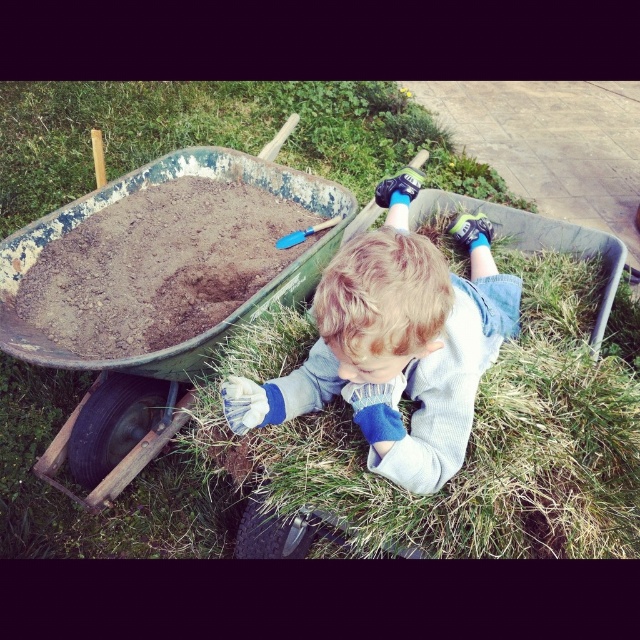
Is brown gravel at center thinner than blue denim jeans at lower center?

In fact, brown gravel at center might be wider than blue denim jeans at lower center.

The height and width of the screenshot is (640, 640). Describe the element at coordinates (157, 266) in the screenshot. I see `brown gravel at center` at that location.

You are a GUI agent. You are given a task and a screenshot of the screen. Output one action in this format:
    pyautogui.click(x=<x>, y=<y>)
    Task: Click on the brown gravel at center
    The height and width of the screenshot is (640, 640).
    Given the screenshot: What is the action you would take?
    pyautogui.click(x=157, y=266)

The height and width of the screenshot is (640, 640). Describe the element at coordinates (396, 342) in the screenshot. I see `light blue denim pants at lower center` at that location.

Between light blue denim pants at lower center and brown gravel at center, which one appears on the right side from the viewer's perspective?

Positioned to the right is light blue denim pants at lower center.

Find the location of `light blue denim pants at lower center`. light blue denim pants at lower center is located at coordinates (396, 342).

Who is taller, light blue denim pants at lower center or blue denim jeans at lower center?

With more height is blue denim jeans at lower center.

Is light blue denim pants at lower center taller than blue denim jeans at lower center?

No.

Is point (317, 378) less distant than point (300, 525)?

Yes.

The image size is (640, 640). In order to click on light blue denim pants at lower center in this screenshot , I will do `click(396, 342)`.